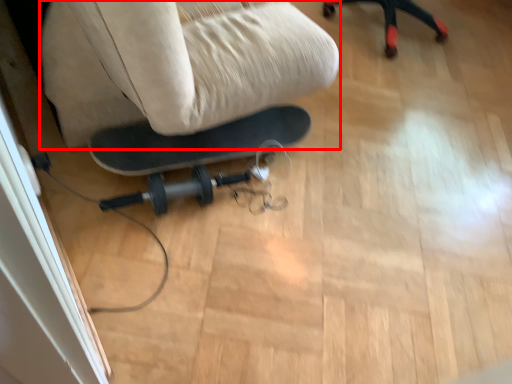
Question: From the image, what is the correct spatial relationship of swivel chair (annotated by the red box) in relation to screen door?

Choices:
 (A) left
 (B) right

Answer: (B)